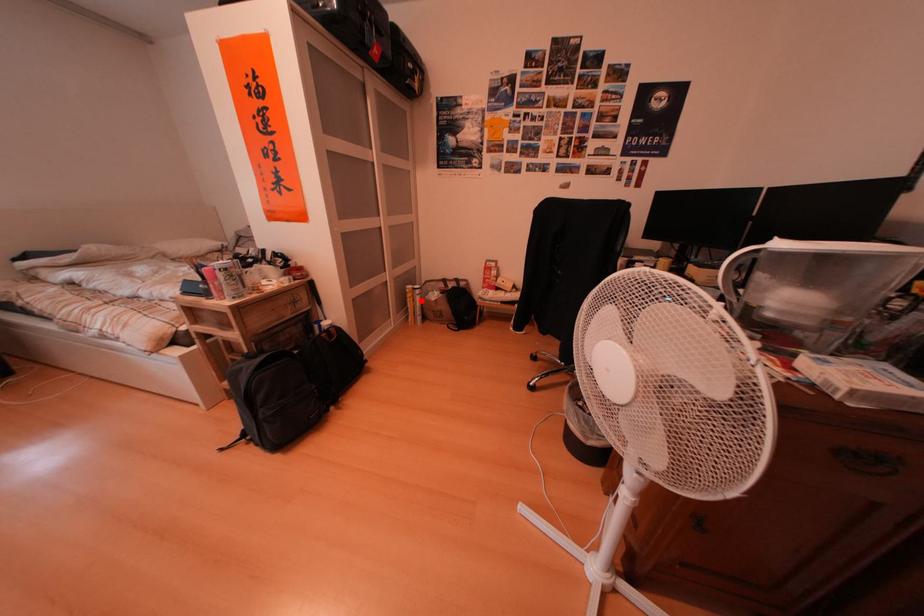
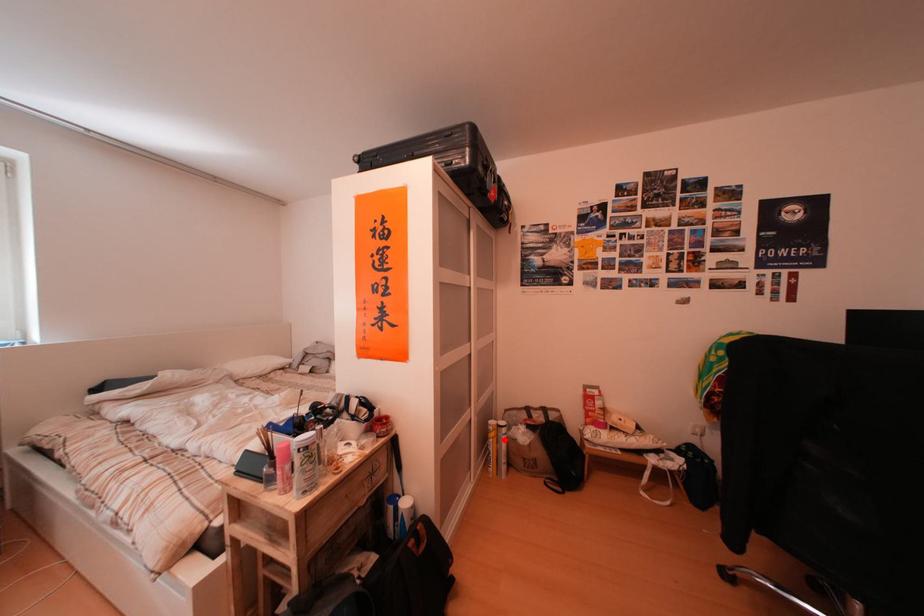
I am providing you with two images of the same scene from different viewpoints. A red point is marked on the first image and another point is marked on the second image. Are the points marked in image1 and image2 representing the same 3D position?

Yes